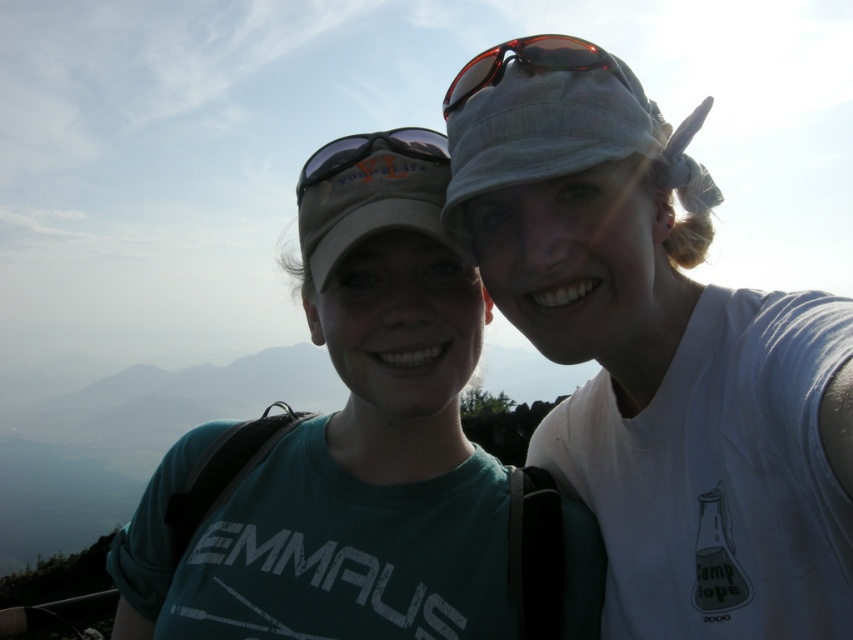
Question: In this image, where is matte gray baseball cap at upper center located relative to shiny red sunglasses at center?

Choices:
 (A) left
 (B) right

Answer: (A)

Question: Which of these objects is positioned closest to the shiny red sunglasses at center?

Choices:
 (A) matte gray goggles at center
 (B) matte gray baseball cap at upper center

Answer: (A)

Question: Which point appears closest to the camera in this image?

Choices:
 (A) [590, 56]
 (B) [364, 212]
 (C) [407, 140]

Answer: (A)

Question: Which of these objects is positioned closest to the matte gray baseball cap at upper center?

Choices:
 (A) shiny red sunglasses at center
 (B) matte gray goggles at center

Answer: (B)

Question: Can you confirm if matte gray baseball cap at upper center is thinner than shiny red sunglasses at center?

Choices:
 (A) no
 (B) yes

Answer: (A)

Question: From the image, what is the correct spatial relationship of matte gray baseball cap at upper center in relation to shiny red sunglasses at center?

Choices:
 (A) left
 (B) right

Answer: (A)